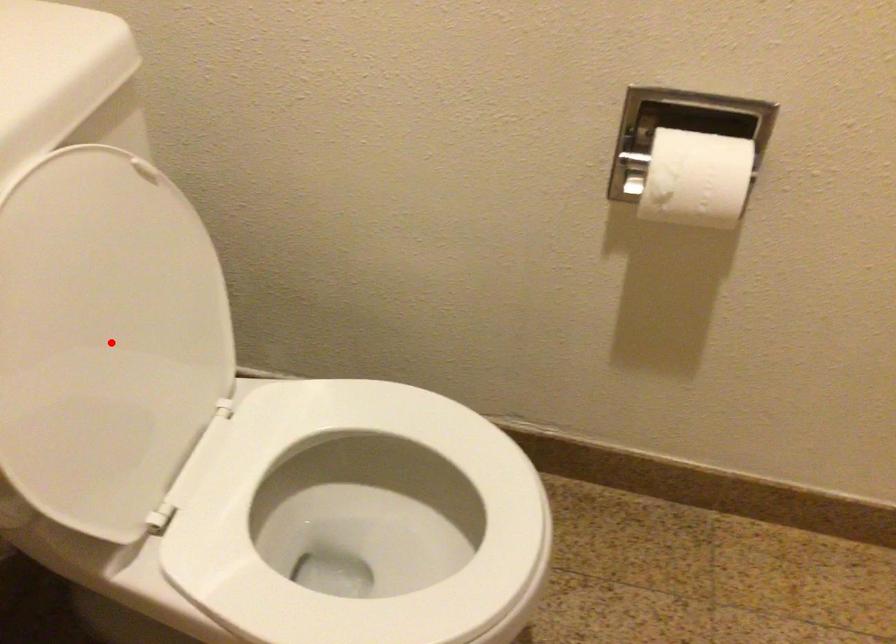
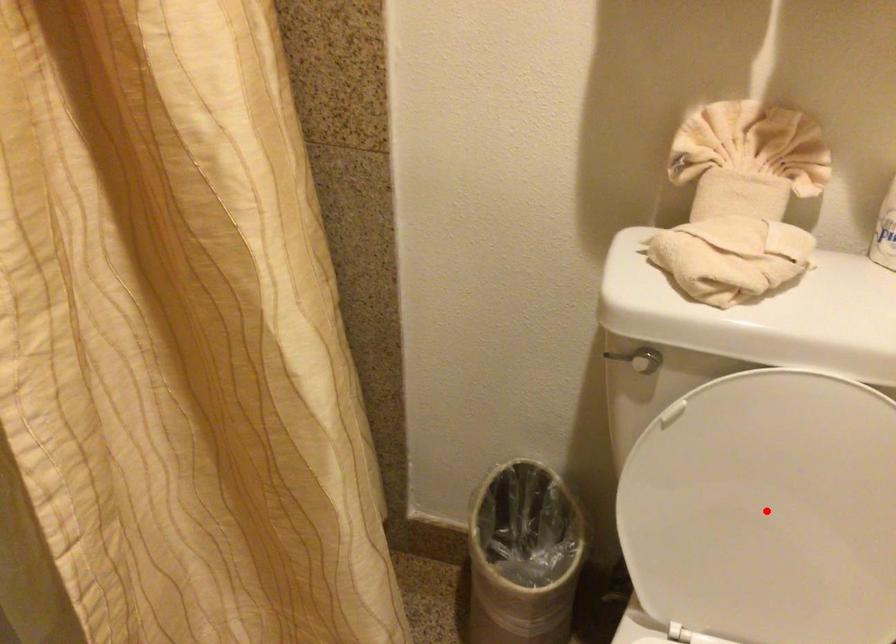
I am providing you with two images of the same scene from different viewpoints. A red point is marked on the first image and another point is marked on the second image. Do the highlighted points in image1 and image2 indicate the same real-world spot?

Yes